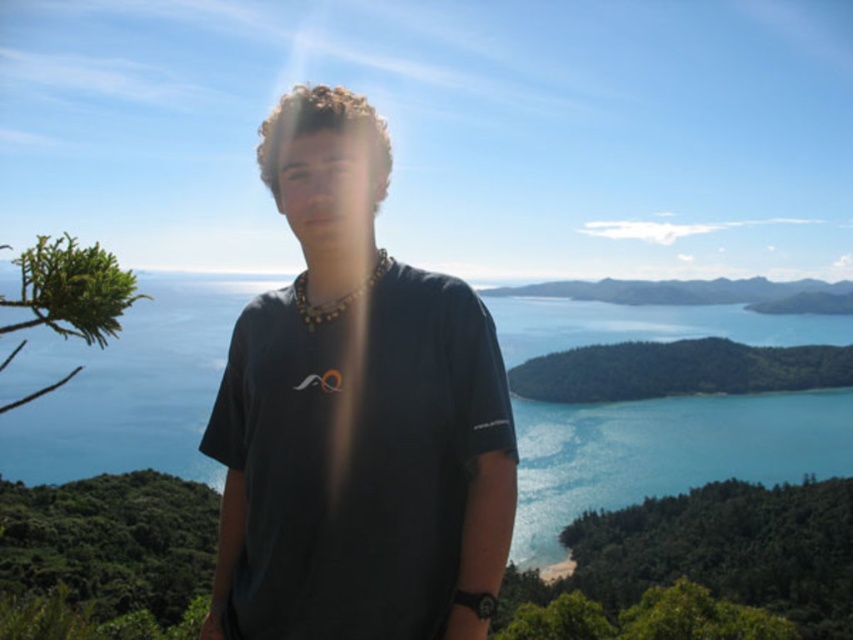
Who is more distant from viewer, (474,452) or (231,307)?

Positioned behind is point (231,307).

Which is behind, point (320, 413) or point (737, 412)?

Point (737, 412)

This screenshot has width=853, height=640. I want to click on dark blue t-shirt at center, so click(357, 417).